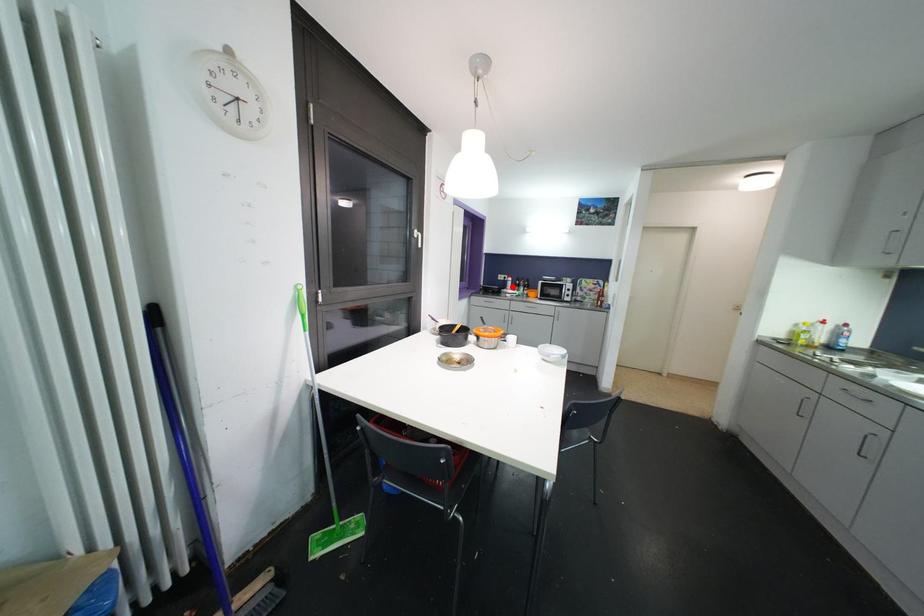
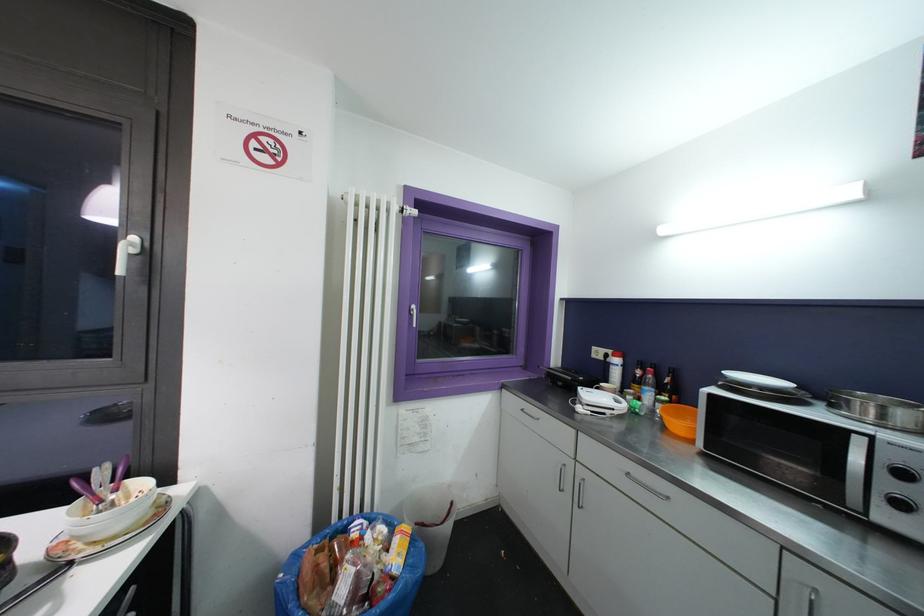
Question: I am providing you with two images of the same scene from different viewpoints. A red point is marked on the first image. At the location where the point appears in image 1, is it still visible in image 2?

Choices:
 (A) Yes
 (B) No

Answer: (A)